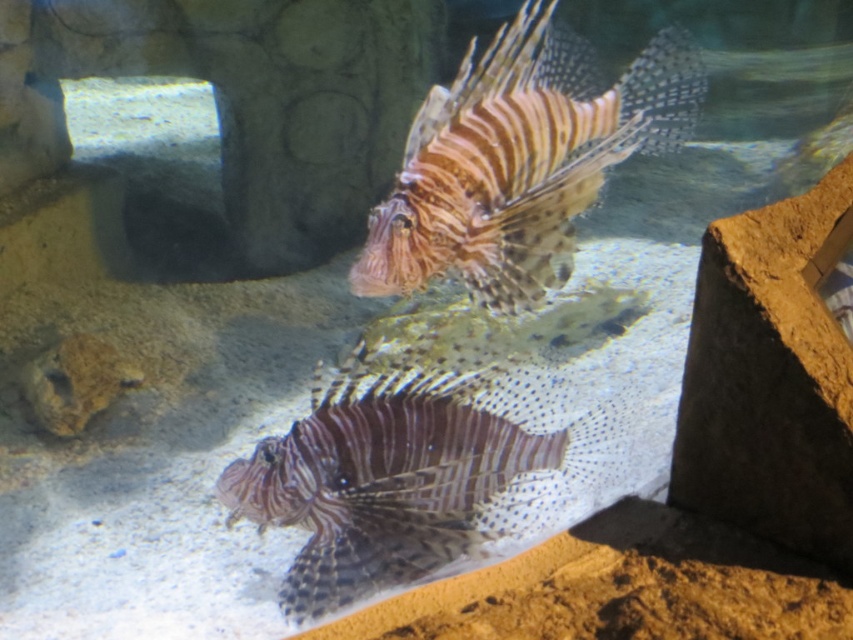
How much distance is there between spotted purple fish at center and brown striped fish at center?

They are 19.18 inches apart.

Is point (471, 445) positioned in front of point (447, 177)?

No, (471, 445) is behind (447, 177).

The image size is (853, 640). What do you see at coordinates (415, 472) in the screenshot?
I see `spotted purple fish at center` at bounding box center [415, 472].

Where is `spotted purple fish at center`? The height and width of the screenshot is (640, 853). spotted purple fish at center is located at coordinates (415, 472).